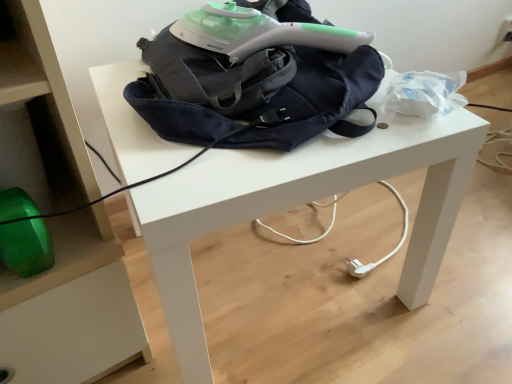
What is the approximate width of denim backpack at center?

denim backpack at center is 41.23 centimeters in width.

What do you see at coordinates (257, 84) in the screenshot?
I see `denim backpack at center` at bounding box center [257, 84].

Locate an element on the screen. This screenshot has width=512, height=384. denim backpack at center is located at coordinates tap(257, 84).

Locate an element on the screen. This screenshot has width=512, height=384. white matte table at center is located at coordinates (300, 204).

What do you see at coordinates (300, 204) in the screenshot?
I see `white matte table at center` at bounding box center [300, 204].

The width and height of the screenshot is (512, 384). I want to click on denim backpack at center, so pos(257,84).

Does denim backpack at center appear on the left side of white matte table at center?

Correct, you'll find denim backpack at center to the left of white matte table at center.

Consider the image. Does denim backpack at center come behind white matte table at center?

Yes.

Between point (173, 43) and point (390, 78), which one is positioned in front?

The point (390, 78) is closer.

From the image's perspective, which object appears higher, denim backpack at center or white matte table at center?

From the image's view, denim backpack at center is above.

From a real-world perspective, does denim backpack at center sit lower than white matte table at center?

No.

Which of these two, denim backpack at center or white matte table at center, is thinner?

denim backpack at center.

From their relative heights in the image, would you say denim backpack at center is taller or shorter than white matte table at center?

Clearly, denim backpack at center is shorter compared to white matte table at center.

Is denim backpack at center bigger than white matte table at center?

No, denim backpack at center is not bigger than white matte table at center.

Can we say denim backpack at center lies outside white matte table at center?

denim backpack at center is positioned outside white matte table at center.

Are denim backpack at center and white matte table at center far apart?

They are positioned close to each other.

Is denim backpack at center oriented away from white matte table at center?

No.

How different are the orientations of denim backpack at center and white matte table at center in degrees?

The facing directions of denim backpack at center and white matte table at center are 0.000462 degrees apart.

Where is `bag lying on the left of white matte table at center`? This screenshot has height=384, width=512. bag lying on the left of white matte table at center is located at coordinates (257, 84).

Considering the relative positions of white matte table at center and denim backpack at center in the image provided, is white matte table at center to the right of denim backpack at center from the viewer's perspective?

Yes, white matte table at center is to the right of denim backpack at center.

Which is in front, white matte table at center or denim backpack at center?

white matte table at center.

Is point (106, 86) positioned in front of point (170, 51)?

No, (106, 86) is further to viewer.

From the image's perspective, which is above, white matte table at center or denim backpack at center?

denim backpack at center appears higher in the image.

From a real-world perspective, which object rests below the other?

From a 3D spatial view, white matte table at center is below.

Which object is wider, white matte table at center or denim backpack at center?

white matte table at center.

Looking at this image, who is taller, white matte table at center or denim backpack at center?

With more height is white matte table at center.

Which of these two, white matte table at center or denim backpack at center, is smaller?

denim backpack at center is smaller.

Would you say white matte table at center contains denim backpack at center?

No, denim backpack at center is not inside white matte table at center.

Is white matte table at center next to denim backpack at center and touching it?

white matte table at center and denim backpack at center are not in contact.

Does white matte table at center turn towards denim backpack at center?

No, white matte table at center does not turn towards denim backpack at center.

How many degrees apart are the facing directions of white matte table at center and denim backpack at center?

0.000462 degrees separate the facing orientations of white matte table at center and denim backpack at center.

How much distance is there between white matte table at center and denim backpack at center?

white matte table at center and denim backpack at center are 4.90 inches apart from each other.

Where is `table in front of the denim backpack at center`? The image size is (512, 384). table in front of the denim backpack at center is located at coordinates (300, 204).

I want to click on table on the right of denim backpack at center, so click(x=300, y=204).

The width and height of the screenshot is (512, 384). In order to click on table in front of the denim backpack at center in this screenshot , I will do click(300, 204).